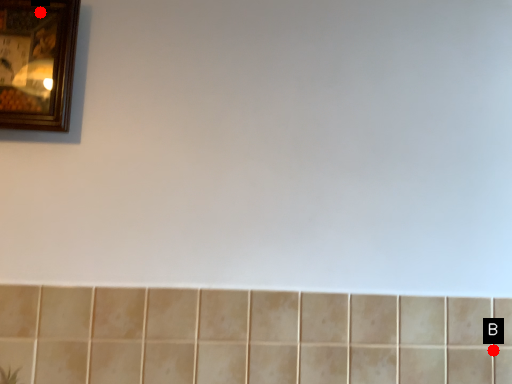
Question: Two points are circled on the image, labeled by A and B beside each circle. Among these points, which one is nearest to the camera?

Choices:
 (A) A is closer
 (B) B is closer

Answer: (A)